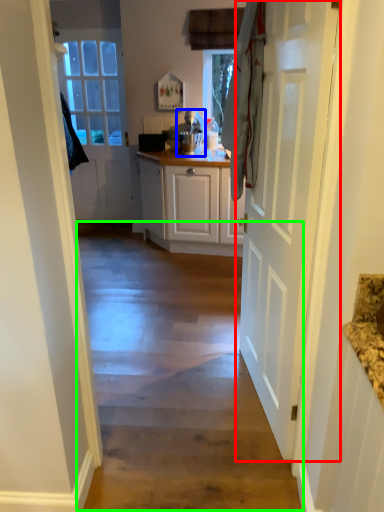
Question: Which object is positioned farthest from door (highlighted by a red box)? Select from appliance (highlighted by a blue box) and path (highlighted by a green box).

Choices:
 (A) appliance
 (B) path

Answer: (A)